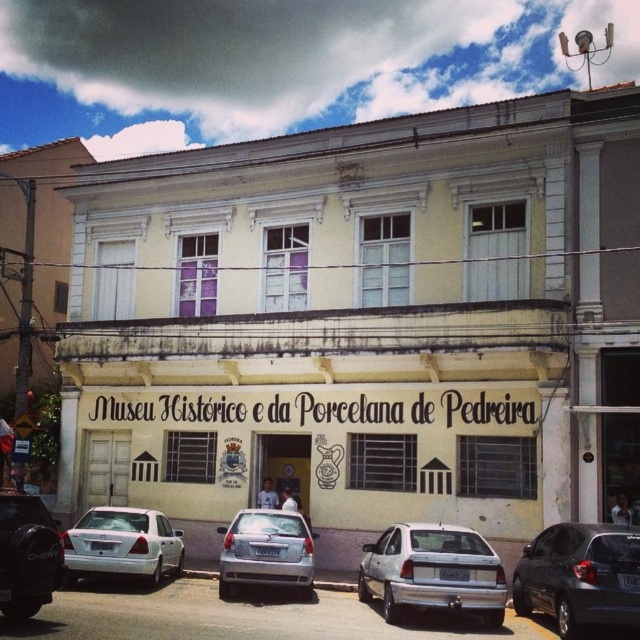
You are a tour guide leading a group to the Museu Hist?rico e da Porcelana de Pedreira. You notice the yellow matte building at center and the white matte sedan at center. Which object is larger in size?

The yellow matte building at center is bigger than the white matte sedan at center according to the description.

You are standing at the camera position and want to take a photo of the yellow matte building at center. If your camera has a maximum focus range of 30 meters, will you be able to capture the building clearly?

The yellow matte building at center and camera are 33.98 meters apart from each other. Since the distance exceeds the camera maximum focus range of 30 meters, you won not be able to capture the building clearly.